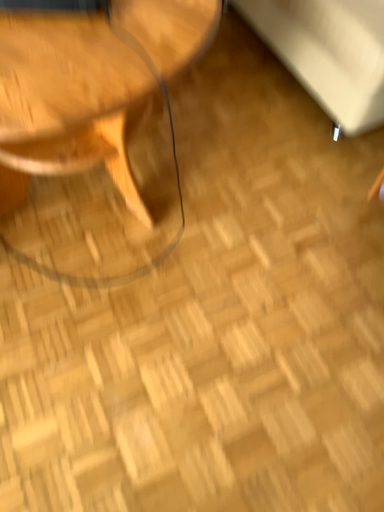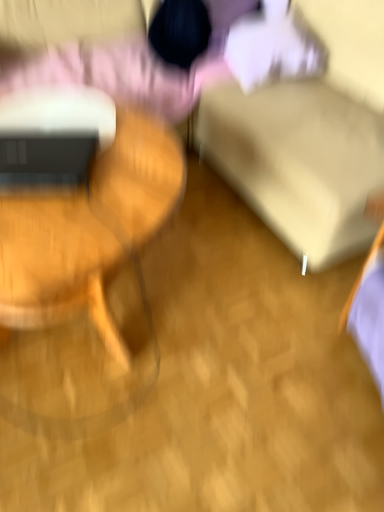
Question: Which way did the camera rotate in the video?

Choices:
 (A) rotated downward
 (B) rotated upward

Answer: (B)